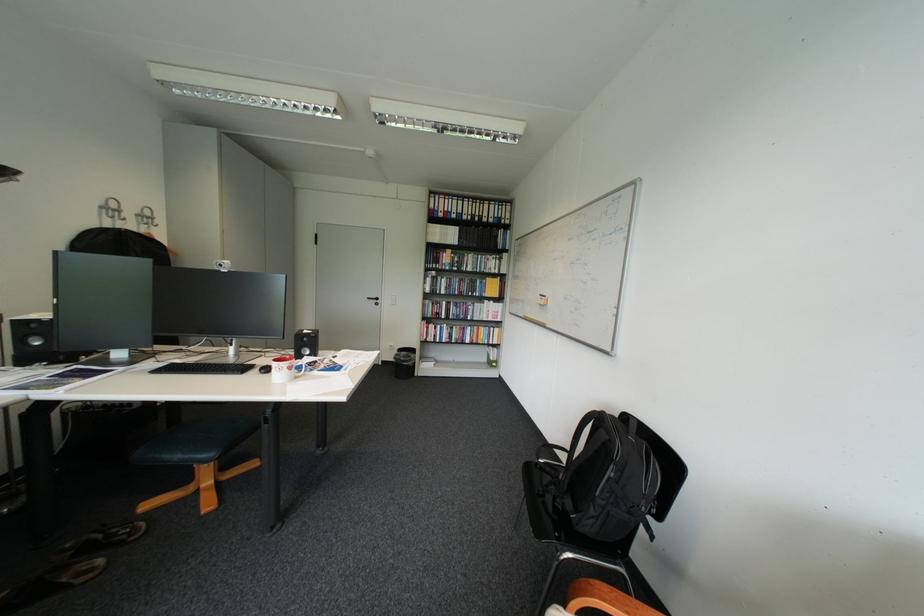
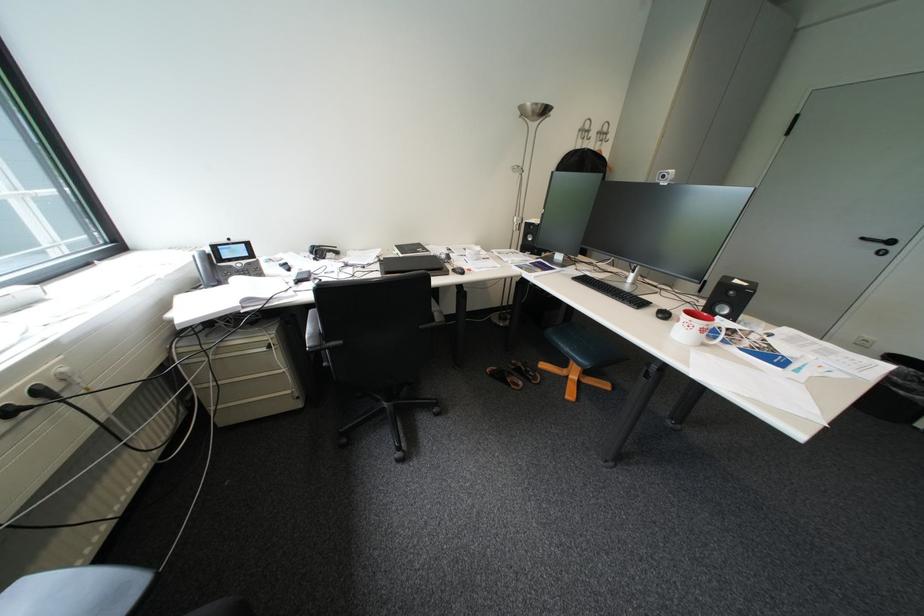
Locate, in the second image, the point that corresponds to point (390, 300) in the first image.

(904, 243)